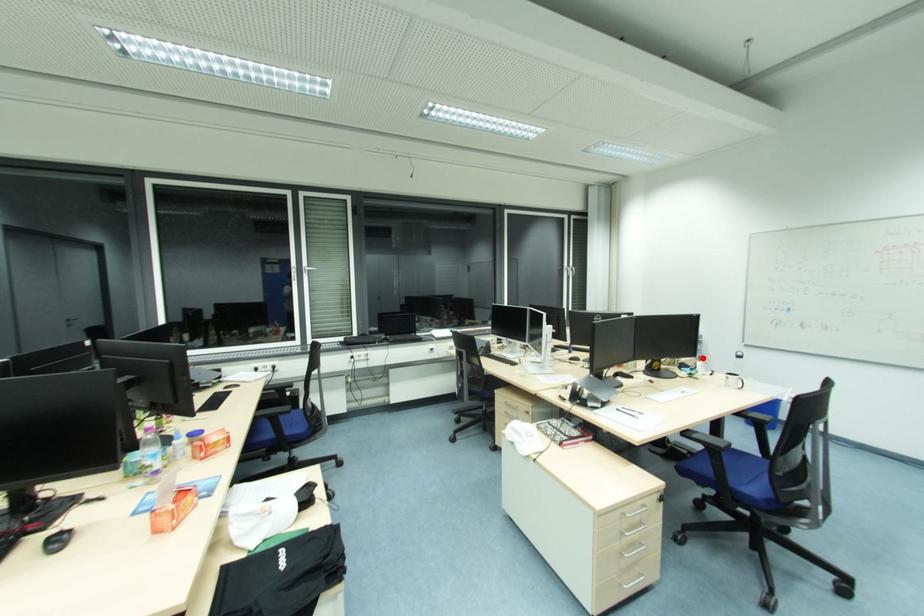
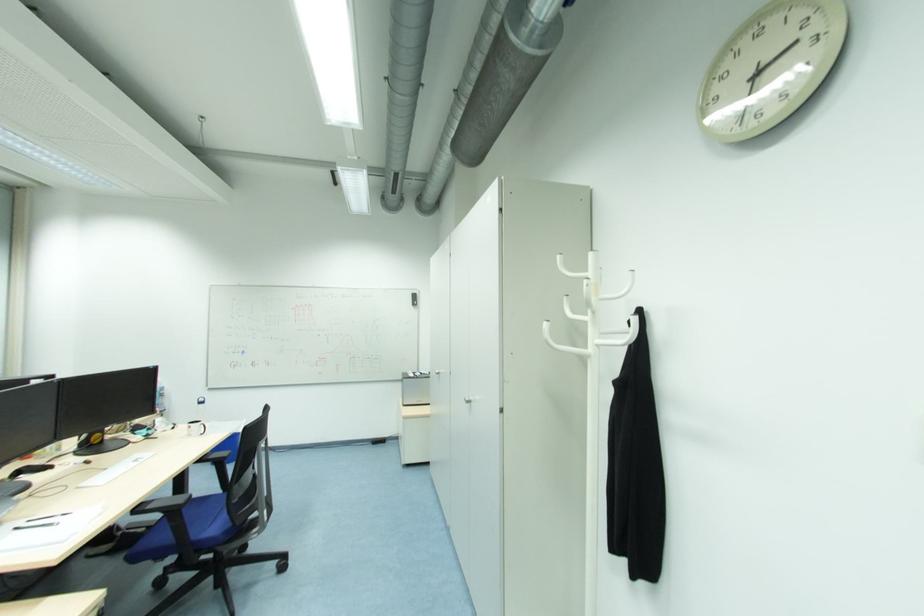
Question: A red point is marked in image1. In image2, is the corresponding 3D point closer to the camera or farther? Reply with the corresponding letter.

Choices:
 (A) The corresponding 3D point is closer.
 (B) The corresponding 3D point is farther.

Answer: (A)